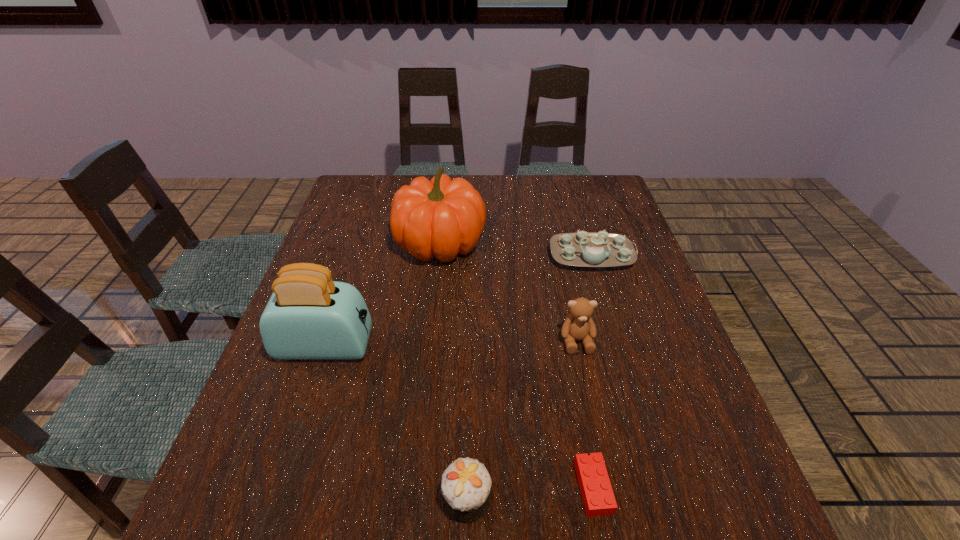
Find the location of a particular element. The width and height of the screenshot is (960, 540). vacant space at the far right corner is located at coordinates (574, 186).

Find the location of a particular element. Image resolution: width=960 pixels, height=540 pixels. vacant point located between the chinaware and the toaster is located at coordinates (459, 301).

Where is `empty location between the shortest object and the cupcake`? Image resolution: width=960 pixels, height=540 pixels. empty location between the shortest object and the cupcake is located at coordinates (530, 493).

This screenshot has height=540, width=960. Find the location of `vacant region between the teddy bear and the pumpkin`. vacant region between the teddy bear and the pumpkin is located at coordinates (509, 292).

Where is `free space between the pumpkin and the cupcake`? The width and height of the screenshot is (960, 540). free space between the pumpkin and the cupcake is located at coordinates (454, 371).

I want to click on free spot between the pumpkin and the chinaware, so click(x=516, y=249).

The width and height of the screenshot is (960, 540). I want to click on unoccupied position between the Lego and the cupcake, so click(x=530, y=493).

Identify the location of free space between the pumpkin and the Lego. The image size is (960, 540). (516, 365).

This screenshot has width=960, height=540. Identify the location of vacant area that lies between the cupcake and the teddy bear. (522, 420).

Find the location of a particular element. The width and height of the screenshot is (960, 540). empty space between the toaster and the chinaware is located at coordinates (459, 301).